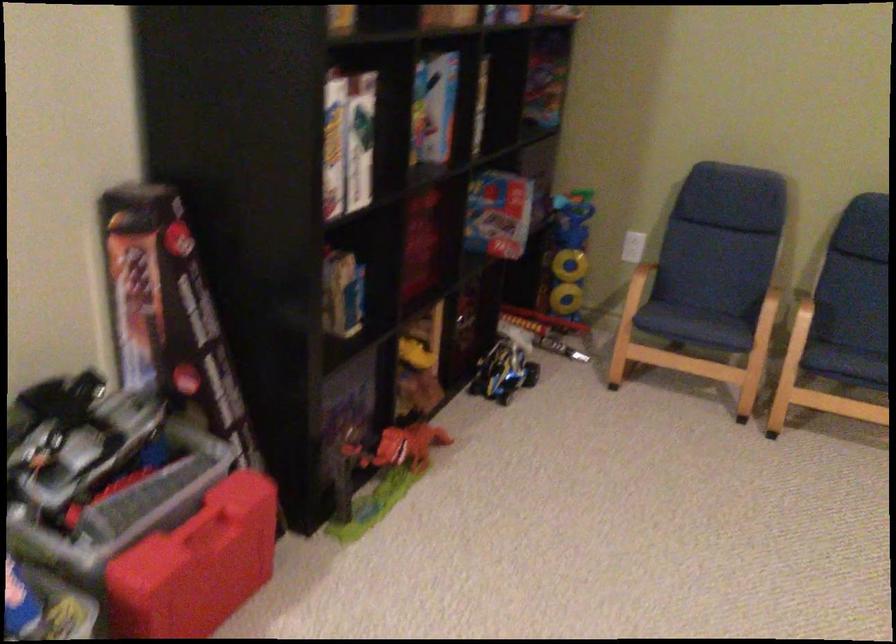
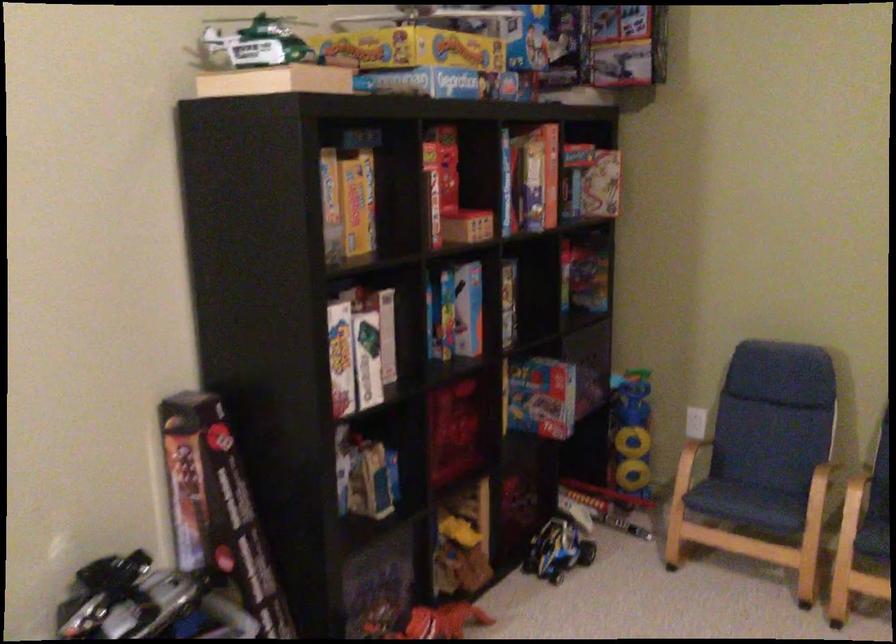
In the second image, find the point that corresponds to point (771, 308) in the first image.

(823, 489)